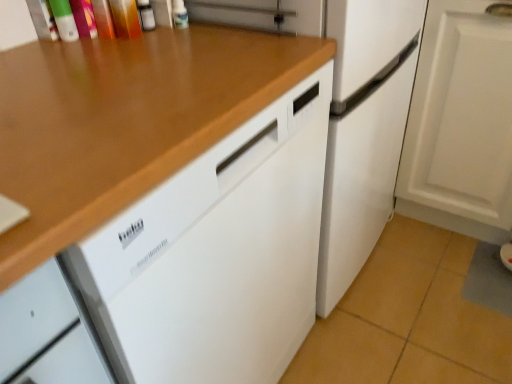
The width and height of the screenshot is (512, 384). Describe the element at coordinates (349, 114) in the screenshot. I see `white matte refrigerator at center` at that location.

Measure the distance between point (139,156) and camera.

Point (139,156) is 19.06 inches away from camera.

At what (x,y) coordinates should I click in order to perform the action: click on white matte refrigerator at center. Please return your answer as a coordinate pair (x, y). This screenshot has width=512, height=384. Looking at the image, I should click on (349, 114).

Relative to white matte refrigerator at center, is white matte cabinet at lower right in front or behind?

white matte cabinet at lower right is behind white matte refrigerator at center.

Can you confirm if white matte cabinet at lower right is bigger than white matte refrigerator at center?

Incorrect, white matte cabinet at lower right is not larger than white matte refrigerator at center.

Is white matte cabinet at lower right next to white matte refrigerator at center and touching it?

There is a gap between white matte cabinet at lower right and white matte refrigerator at center.

In the scene shown: Which object is positioned more to the left, white matte cabinet at lower right or white matte refrigerator at center?

white matte refrigerator at center.

From the picture: What's the angular difference between white matte cabinet at lower right and wooden at upper left's facing directions?

There is a 89-degree angle between the facing directions of white matte cabinet at lower right and wooden at upper left.

Considering the relative sizes of white matte cabinet at lower right and wooden at upper left in the image provided, is white matte cabinet at lower right bigger than wooden at upper left?

No, white matte cabinet at lower right is not bigger than wooden at upper left.

Does white matte cabinet at lower right touch wooden at upper left?

white matte cabinet at lower right and wooden at upper left are not in contact.

How distant is white matte cabinet at lower right from wooden at upper left?

The distance of white matte cabinet at lower right from wooden at upper left is 34.15 inches.

From a real-world perspective, between white matte refrigerator at center and wooden at upper left, who is vertically higher?

In real-world perspective, white matte refrigerator at center is above.

Is white matte refrigerator at center not inside wooden at upper left?

white matte refrigerator at center is positioned outside wooden at upper left.

Is white matte refrigerator at center thinner than wooden at upper left?

Incorrect, the width of white matte refrigerator at center is not less than that of wooden at upper left.

The height and width of the screenshot is (384, 512). I want to click on countertop below the white matte refrigerator at center (from a real-world perspective), so click(x=124, y=121).

How different are the orientations of wooden at upper left and white matte refrigerator at center in degrees?

wooden at upper left and white matte refrigerator at center are facing 0.098 degrees away from each other.

Measure the distance between wooden at upper left and white matte refrigerator at center.

wooden at upper left is 14.86 inches away from white matte refrigerator at center.

From a real-world perspective, relative to white matte refrigerator at center, is wooden at upper left vertically above or below?

wooden at upper left is situated lower than white matte refrigerator at center in the real world.

Considering the sizes of objects wooden at upper left and white matte refrigerator at center in the image provided, who is wider, wooden at upper left or white matte refrigerator at center?

With larger width is white matte refrigerator at center.

In the scene shown: Is there a large distance between wooden at upper left and white matte cabinet at lower right?

That's not correct — wooden at upper left is a little close to white matte cabinet at lower right.

Can you confirm if wooden at upper left is shorter than white matte cabinet at lower right?

Incorrect, the height of wooden at upper left does not fall short of that of white matte cabinet at lower right.

Could you tell me if wooden at upper left is facing white matte cabinet at lower right?

No, wooden at upper left is not aimed at white matte cabinet at lower right.

Can you confirm if wooden at upper left is smaller than white matte cabinet at lower right?

No, wooden at upper left is not smaller than white matte cabinet at lower right.

From the picture: Can you confirm if white matte refrigerator at center is wider than white matte cabinet at lower right?

Correct, the width of white matte refrigerator at center exceeds that of white matte cabinet at lower right.

From a real-world perspective, is white matte refrigerator at center physically above white matte cabinet at lower right?

Indeed, from a real-world perspective, white matte refrigerator at center stands above white matte cabinet at lower right.

From the image's perspective, would you say white matte refrigerator at center is positioned over white matte cabinet at lower right?

Actually, white matte refrigerator at center appears below white matte cabinet at lower right in the image.

This screenshot has width=512, height=384. Identify the location of cabinetry lying on the right of white matte refrigerator at center. (461, 123).

Where is `cabinetry below the wooden at upper left (from a real-world perspective)`? The width and height of the screenshot is (512, 384). cabinetry below the wooden at upper left (from a real-world perspective) is located at coordinates (461, 123).

From the image, which object appears to be nearer to wooden at upper left, white matte cabinet at lower right or white matte refrigerator at center?

white matte refrigerator at center.

From the image, which object appears to be nearer to white matte cabinet at lower right, wooden at upper left or white matte refrigerator at center?

white matte refrigerator at center.

When comparing their distances from wooden at upper left, does white matte refrigerator at center or white matte cabinet at lower right seem further?

white matte cabinet at lower right is positioned further to the anchor wooden at upper left.

Which object lies further to the anchor point white matte cabinet at lower right, white matte refrigerator at center or wooden at upper left?

Based on the image, wooden at upper left appears to be further to white matte cabinet at lower right.

Based on their spatial positions, is white matte cabinet at lower right or wooden at upper left closer to white matte refrigerator at center?

Among the two, white matte cabinet at lower right is located nearer to white matte refrigerator at center.

From the image, which object appears to be farther from white matte refrigerator at center, wooden at upper left or white matte cabinet at lower right?

wooden at upper left is positioned further to the anchor white matte refrigerator at center.

Identify the location of refrigerator between wooden at upper left and white matte cabinet at lower right in the horizontal direction. (349, 114).